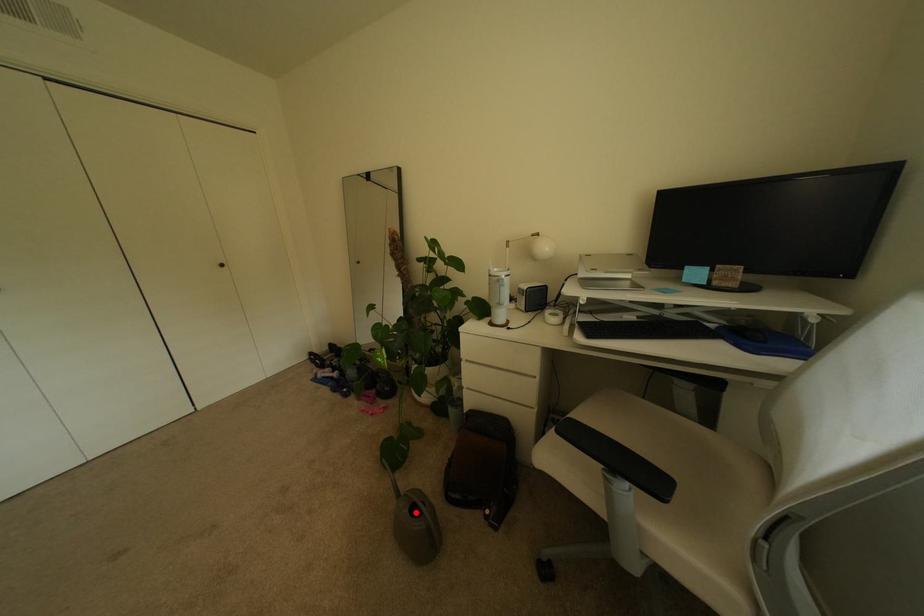
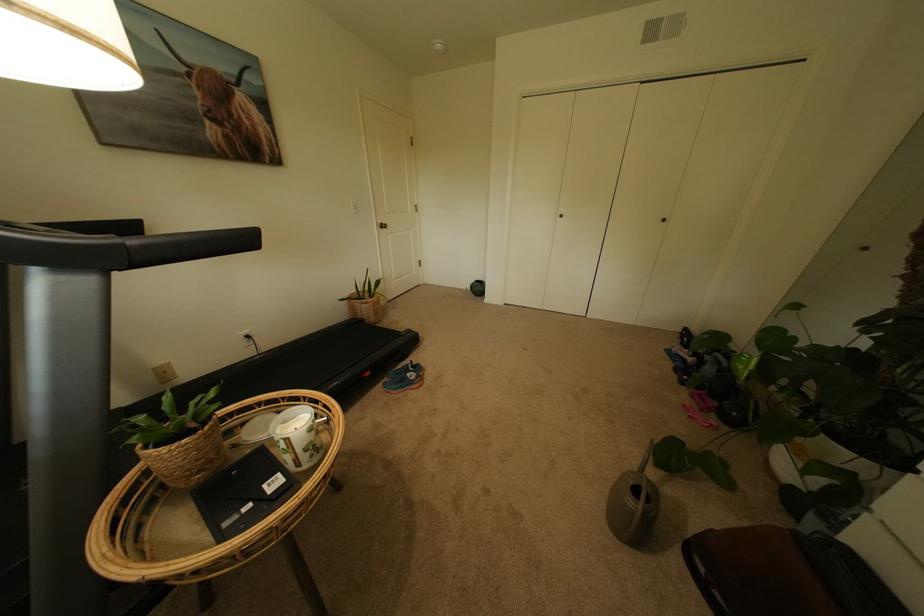
Question: I am providing you with two images of the same scene from different viewpoints. A red point is shown in image1. For the corresponding object point in image2, is it positioned nearer or farther from the camera?

Choices:
 (A) Nearer
 (B) Farther

Answer: (A)